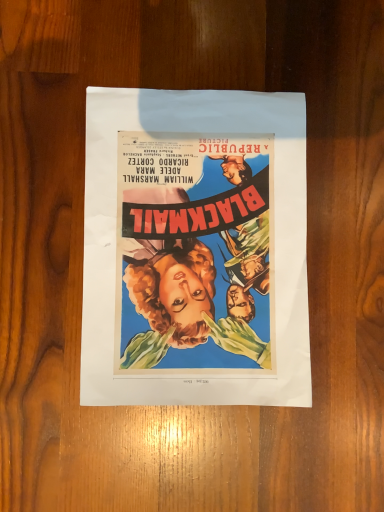
What do you see at coordinates (195, 249) in the screenshot? I see `vibrant paper poster at center` at bounding box center [195, 249].

Where is `vibrant paper poster at center`? vibrant paper poster at center is located at coordinates (195, 249).

At what (x,y) coordinates should I click in order to perform the action: click on vibrant paper poster at center. Please return your answer as a coordinate pair (x, y). This screenshot has width=384, height=512. Looking at the image, I should click on (195, 249).